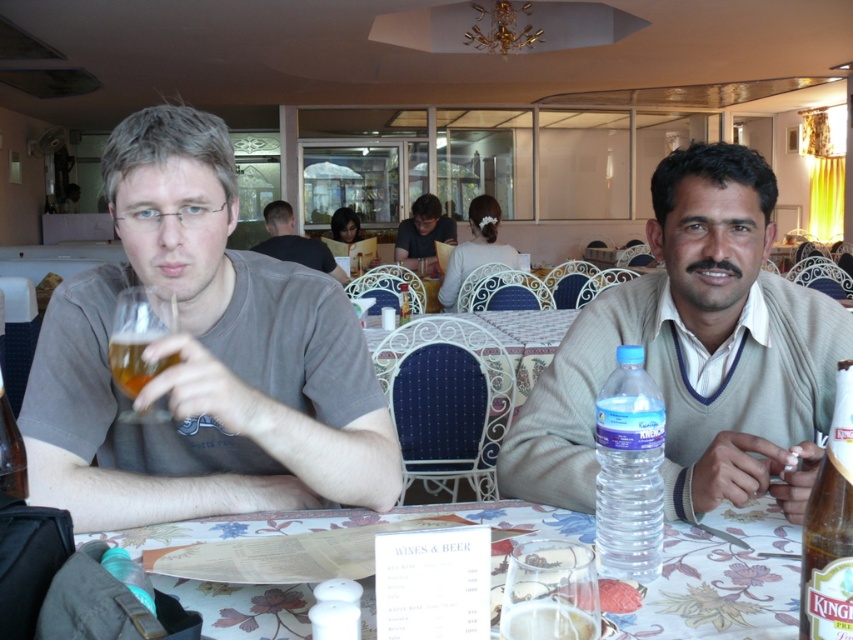
Question: Among these objects, which one is nearest to the camera?

Choices:
 (A) white printed paper at center
 (B) beige sweater at right

Answer: (A)

Question: Is amber glass beer at left thinner than brown glass bottle at lower left?

Choices:
 (A) yes
 (B) no

Answer: (B)

Question: Which point appears farthest from the camera in this image?

Choices:
 (A) (0, 449)
 (B) (816, 529)
 (C) (405, 314)
 (D) (138, 321)

Answer: (C)

Question: Does matte gray shirt at left have a smaller size compared to golden amber liquid at glass left?

Choices:
 (A) yes
 (B) no

Answer: (B)

Question: Which object is positioned farthest from the dark brown hair at center?

Choices:
 (A) beige sweater at right
 (B) clear glass bottle at table center
 (C) amber glass beer at left
 (D) white printed paper at center

Answer: (B)

Question: Can you confirm if clear plastic bottle at table center is wider than translucent glass at table center?

Choices:
 (A) no
 (B) yes

Answer: (A)